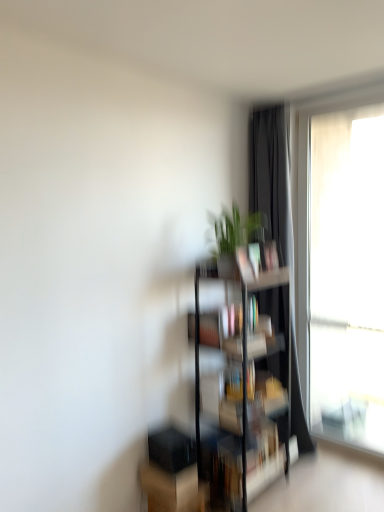
Question: Is point pos(334,228) positioned closer to the camera than point pos(271,106)?

Choices:
 (A) closer
 (B) farther

Answer: (B)

Question: Would you say translucent fabric at right is to the left or to the right of black matte curtain at right in the picture?

Choices:
 (A) right
 (B) left

Answer: (A)

Question: Estimate the real-world distances between objects in this image. Which object is farther from the clear glass bookshelf at center?

Choices:
 (A) green matte plant at center
 (B) translucent fabric at right
 (C) black matte curtain at right
 (D) matte black bookshelf at center

Answer: (B)

Question: Which of these objects is positioned farthest from the clear glass bookshelf at center?

Choices:
 (A) green matte plant at center
 (B) black matte curtain at right
 (C) translucent fabric at right
 (D) matte black bookshelf at center

Answer: (C)